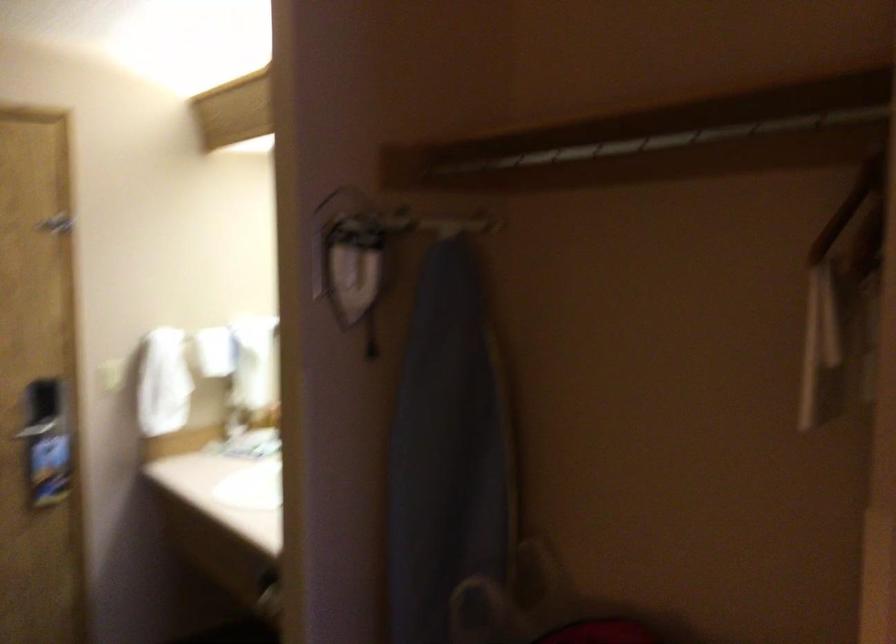
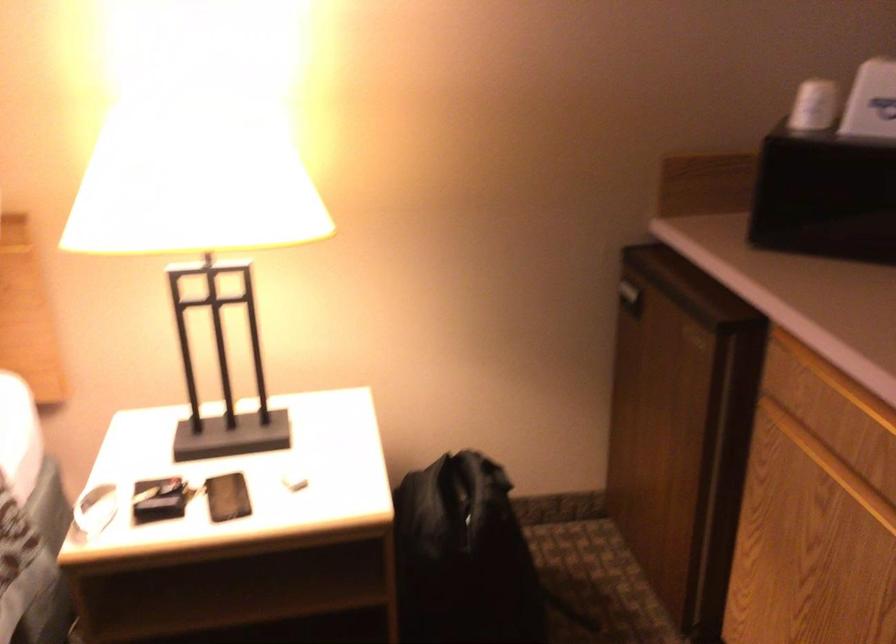
Based on the photo, first-person continuous shooting, in which direction is the camera rotating?

The rotation direction of the camera is left-down.